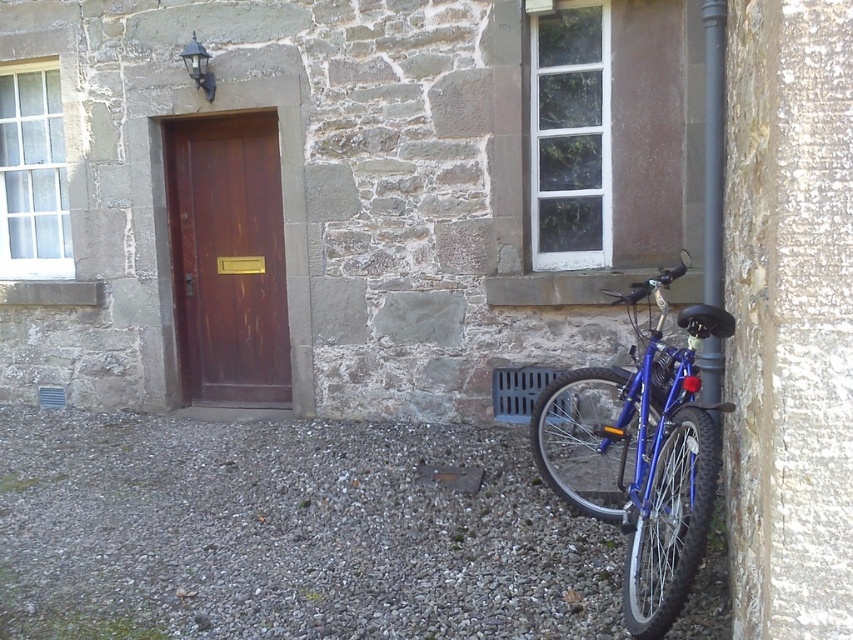
Question: Does blue metallic bicycle at right come in front of brown wooden door at center?

Choices:
 (A) yes
 (B) no

Answer: (A)

Question: Among these objects, which one is nearest to the camera?

Choices:
 (A) brown wooden door at center
 (B) blue metallic bicycle at right

Answer: (B)

Question: Can you confirm if blue metallic bicycle at right is smaller than brown wooden door at center?

Choices:
 (A) no
 (B) yes

Answer: (A)

Question: Is blue metallic bicycle at right smaller than brown wooden door at center?

Choices:
 (A) yes
 (B) no

Answer: (B)

Question: Which of the following is the closest to the observer?

Choices:
 (A) brown wooden door at center
 (B) blue metallic bicycle at right

Answer: (B)